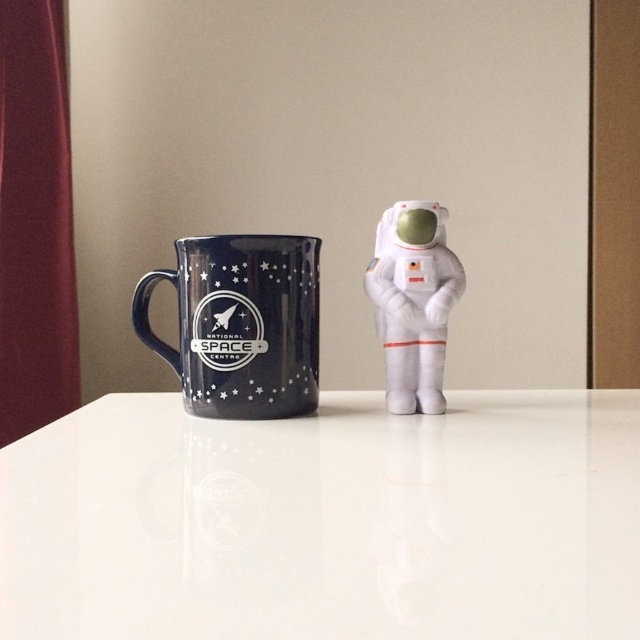
You are organizing a space theme party and have both the white glossy table at center and the white plush astronaut at center. If you want to place the astronaut on the table, will it fit?

The white glossy table at center is larger in size than the white plush astronaut at center, so yes, the astronaut will fit on the table.

In the scene shown: You are setting up a display on a table and want to place a small decorative item between the glossy ceramic mug at upper center and the white plush astronaut at center. Given that the item is 5 cm wide, will there be enough space between them?

The glossy ceramic mug at upper center is closer to the viewer than the white plush astronaut at center, so there is sufficient space between them to place a 5 cm wide item.